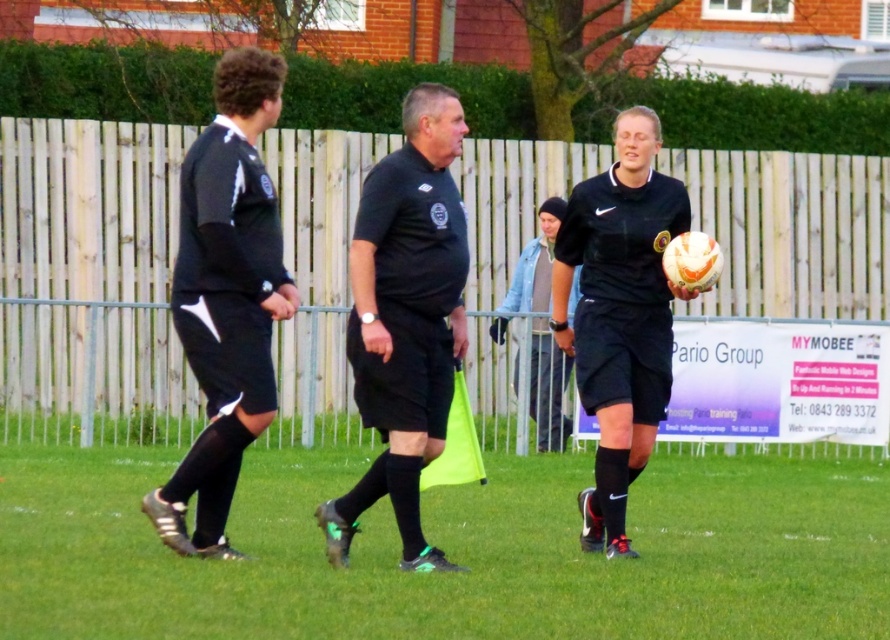
Question: Does matte black uniform at center appear under denim jacket at center?

Choices:
 (A) no
 (B) yes

Answer: (B)

Question: Which point appears closest to the camera in this image?

Choices:
 (A) (567, 356)
 (B) (794, 628)

Answer: (B)

Question: Can you confirm if black matte shirt at center is wider than black jersey at left?

Choices:
 (A) no
 (B) yes

Answer: (B)

Question: Which point appears closest to the camera in this image?

Choices:
 (A) (638, 442)
 (B) (502, 476)
 (C) (120, 172)

Answer: (A)

Question: Can you confirm if black synthetic turf at center is smaller than black jersey at left?

Choices:
 (A) yes
 (B) no

Answer: (A)

Question: Which object is positioned farthest from the denim jacket at center?

Choices:
 (A) black jersey at left
 (B) black matte shirt at center

Answer: (A)